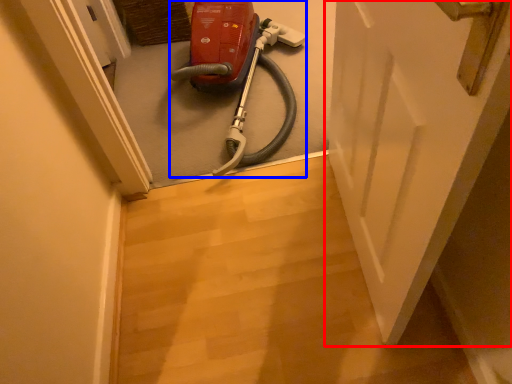
Question: Which point is further to the camera, door (highlighted by a red box) or equipment (highlighted by a blue box)?

Choices:
 (A) door
 (B) equipment

Answer: (B)